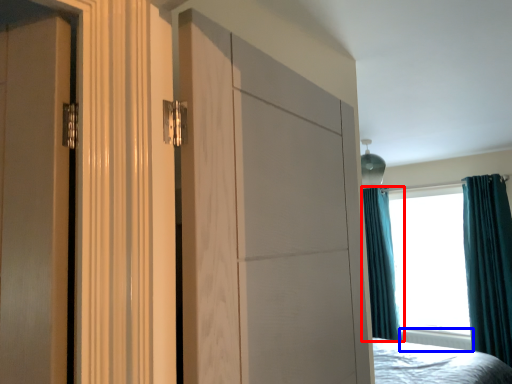
Question: Which of the following is the closest to the observer, curtain (highlighted by a red box) or radiator (highlighted by a blue box)?

Choices:
 (A) curtain
 (B) radiator

Answer: (B)